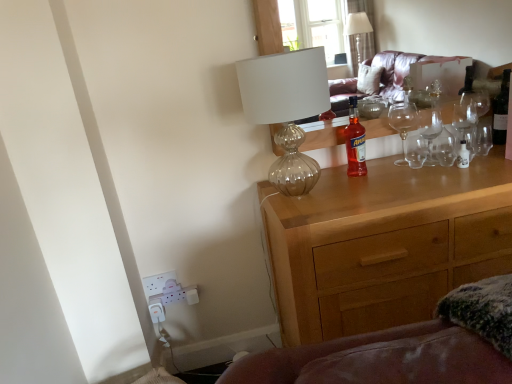
Image resolution: width=512 pixels, height=384 pixels. I want to click on unoccupied region to the right of translucent glass bottle at center, so click(412, 175).